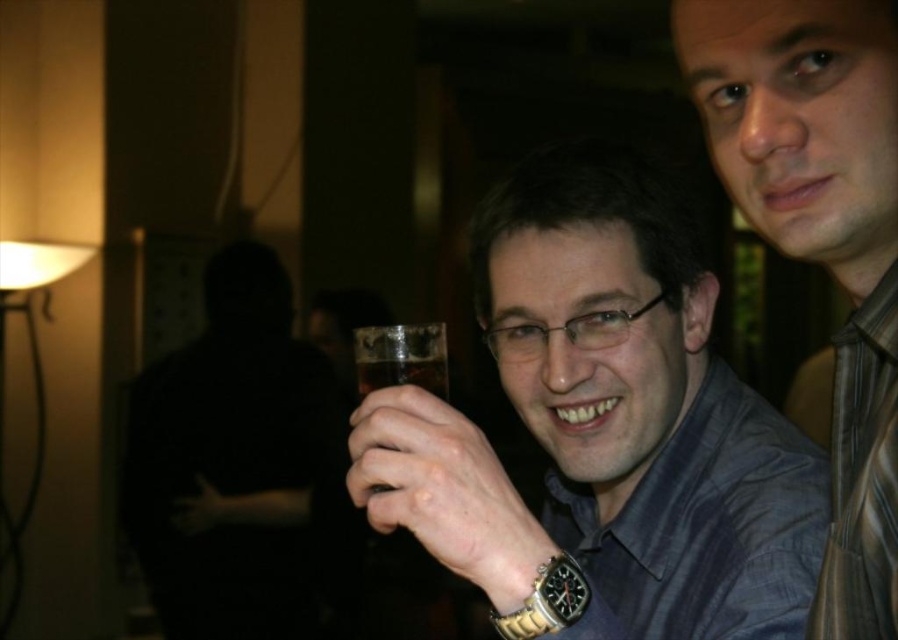
This screenshot has width=898, height=640. I want to click on matte glass at center, so [x=606, y=422].

Between point (462, 445) and point (388, 531), which one is positioned in front?

Point (462, 445) is more forward.

Describe the element at coordinates (606, 422) in the screenshot. I see `matte glass at center` at that location.

You are a GUI agent. You are given a task and a screenshot of the screen. Output one action in this format:
    pyautogui.click(x=<x>, y=<y>)
    Task: Click on the matte glass at center
    Image resolution: width=898 pixels, height=640 pixels.
    Given the screenshot: What is the action you would take?
    pyautogui.click(x=606, y=422)

Who is shorter, matte blue shirt at center or gold metallic watch at center?

With less height is gold metallic watch at center.

Who is taller, matte blue shirt at center or gold metallic watch at center?

With more height is matte blue shirt at center.

Image resolution: width=898 pixels, height=640 pixels. Describe the element at coordinates (821, 234) in the screenshot. I see `matte blue shirt at center` at that location.

At what (x,y) coordinates should I click in order to perform the action: click on matte blue shirt at center. Please return your answer as a coordinate pair (x, y). Image resolution: width=898 pixels, height=640 pixels. Looking at the image, I should click on (821, 234).

Does point (437, 381) lie in front of point (518, 632)?

No, it is behind (518, 632).

Which is above, clear glass at center or gold metallic watch at lower center?

clear glass at center

Is point (394, 376) positioned behind point (542, 572)?

Yes, it is behind point (542, 572).

You are a GUI agent. You are given a task and a screenshot of the screen. Output one action in this format:
    pyautogui.click(x=<x>, y=<y>)
    Task: Click on the clear glass at center
    
    Given the screenshot: What is the action you would take?
    pyautogui.click(x=401, y=356)